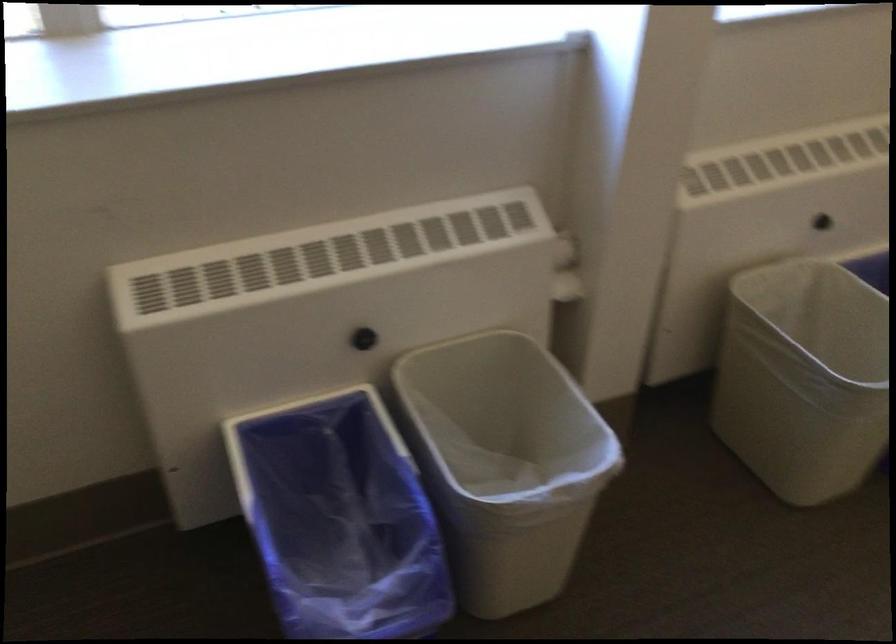
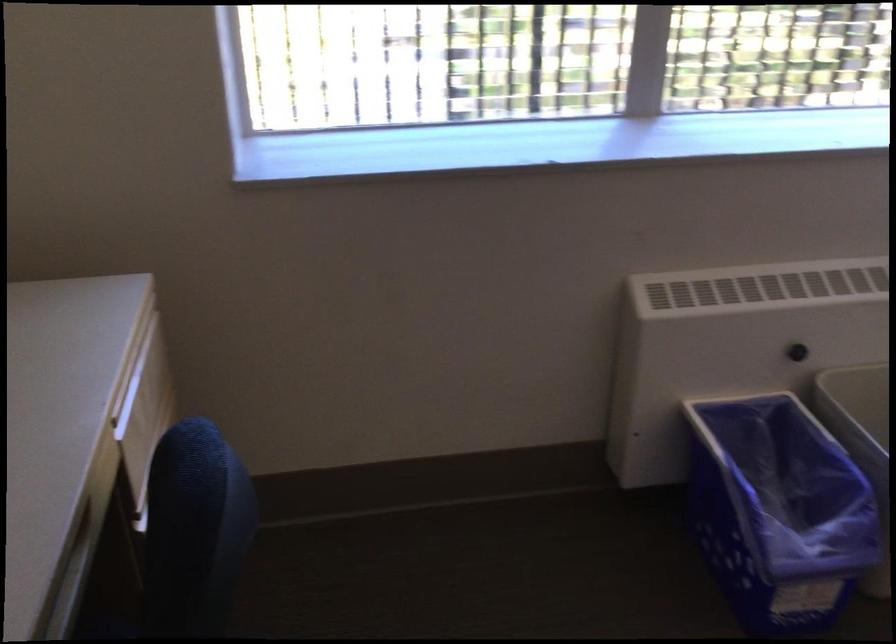
Locate, in the second image, the point that corresponds to the point at 462,368 in the first image.

(860, 391)